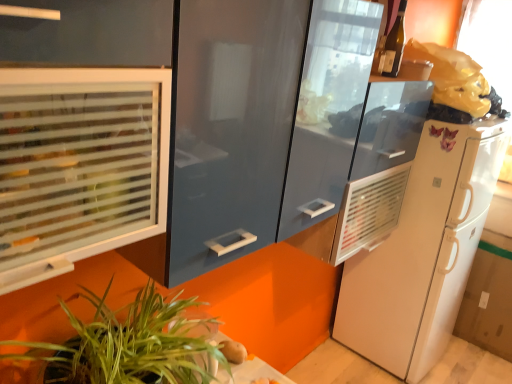
Question: From the image's perspective, is smooth brown potato at lower center located above or below translucent glass wine bottle at upper right?

Choices:
 (A) above
 (B) below

Answer: (B)

Question: In the image, is smooth brown potato at lower center positioned in front of or behind translucent glass wine bottle at upper right?

Choices:
 (A) front
 (B) behind

Answer: (A)

Question: Which object is the farthest from the frosted glass window at left?

Choices:
 (A) green leafy plant at lower left
 (B) white matte refrigerator at right
 (C) translucent glass wine bottle at upper right
 (D) smooth brown potato at lower center

Answer: (B)

Question: Considering the real-world distances, which object is closest to the smooth brown potato at lower center?

Choices:
 (A) frosted glass window at left
 (B) white matte refrigerator at right
 (C) green leafy plant at lower left
 (D) translucent glass wine bottle at upper right

Answer: (C)